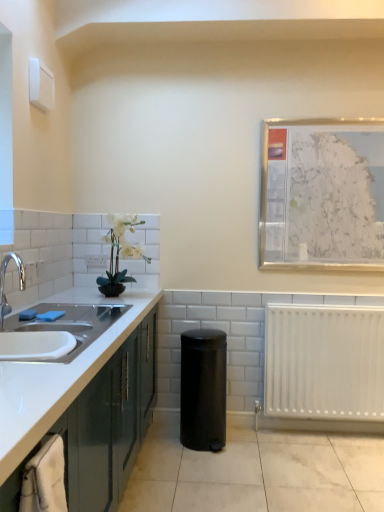
Question: Does white plastic radiator at lower right have a lesser height compared to metallic silver map at upper right?

Choices:
 (A) yes
 (B) no

Answer: (A)

Question: Is white plastic radiator at lower right with metallic silver map at upper right?

Choices:
 (A) yes
 (B) no

Answer: (B)

Question: Can you confirm if white plastic radiator at lower right is positioned to the left of metallic silver map at upper right?

Choices:
 (A) yes
 (B) no

Answer: (B)

Question: Is white plastic radiator at lower right aimed at metallic silver map at upper right?

Choices:
 (A) no
 (B) yes

Answer: (A)

Question: Is white plastic radiator at lower right to the right of metallic silver map at upper right from the viewer's perspective?

Choices:
 (A) no
 (B) yes

Answer: (B)

Question: In the image, is matte green cabinetry at left positioned in front of or behind white matte plant at upper left?

Choices:
 (A) behind
 (B) front

Answer: (B)

Question: Based on their positions, is matte green cabinetry at left located to the left or right of white matte plant at upper left?

Choices:
 (A) left
 (B) right

Answer: (A)

Question: From the image's perspective, relative to white matte plant at upper left, is matte green cabinetry at left above or below?

Choices:
 (A) below
 (B) above

Answer: (A)

Question: Is matte green cabinetry at left bigger or smaller than white matte plant at upper left?

Choices:
 (A) small
 (B) big

Answer: (B)

Question: In the image, is metallic silver map at upper right on the left side or the right side of white ceramic sink at left?

Choices:
 (A) right
 (B) left

Answer: (A)

Question: Considering the positions of metallic silver map at upper right and white ceramic sink at left in the image, is metallic silver map at upper right bigger or smaller than white ceramic sink at left?

Choices:
 (A) small
 (B) big

Answer: (A)

Question: From the image's perspective, relative to white ceramic sink at left, is metallic silver map at upper right above or below?

Choices:
 (A) below
 (B) above

Answer: (B)

Question: Considering the positions of metallic silver map at upper right and white ceramic sink at left in the image, is metallic silver map at upper right taller or shorter than white ceramic sink at left?

Choices:
 (A) short
 (B) tall

Answer: (B)

Question: Is white plastic electric outlet at upper left wider or thinner than black matte trash can at center?

Choices:
 (A) thin
 (B) wide

Answer: (A)

Question: Looking at the image, does white plastic electric outlet at upper left seem bigger or smaller compared to black matte trash can at center?

Choices:
 (A) big
 (B) small

Answer: (B)